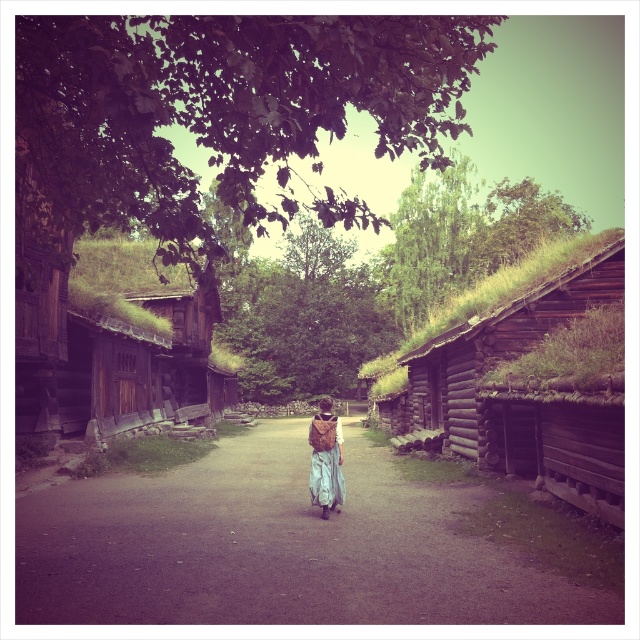
You are standing at the point labeled point [234,477] and want to walk towards the point labeled point [205,232]. Given that both points are along the path flanked by traditional wooden buildings, will you be moving towards or away from the camera?

Since point [234,477] is further to the viewer than point [205,232], moving from point [234,477] towards point [205,232] means you are moving away from the camera.

You are a visitor in this historical village and want to take a photo of the light brown fabric dress at center and the green leafy tree at upper center. Which object should you focus on first if you want to capture both in the same frame without moving the camera?

The green leafy tree at upper center is larger in size compared to the light brown fabric dress at center, so you should focus on the green leafy tree at upper center first to ensure it fits within the frame while still capturing the smaller light brown fabric dress at center.

In the scene shown: You are standing at the starting point of the path in this historical village. You see two points marked on the path ahead. The first point is at coordinate point[330,96] and the second is at point[330,468]. Which point is closer to your current position?

Point[330,96] is closer to your current position because it is in front of point[330,468] along the path.